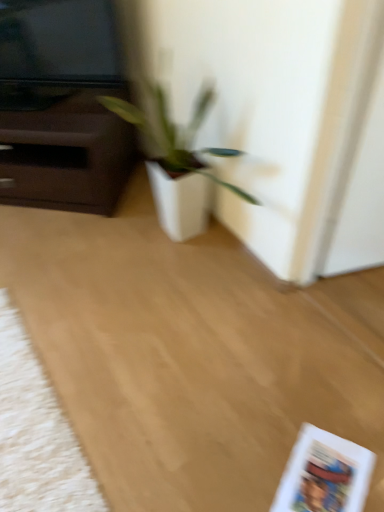
This screenshot has width=384, height=512. Find the location of `free space in front of white matte pot at center`. free space in front of white matte pot at center is located at coordinates (185, 333).